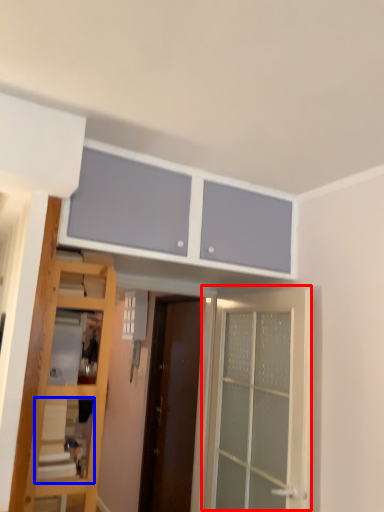
Question: Which point is closer to the camera, door (highlighted by a red box) or shelf (highlighted by a blue box)?

Choices:
 (A) door
 (B) shelf

Answer: (B)